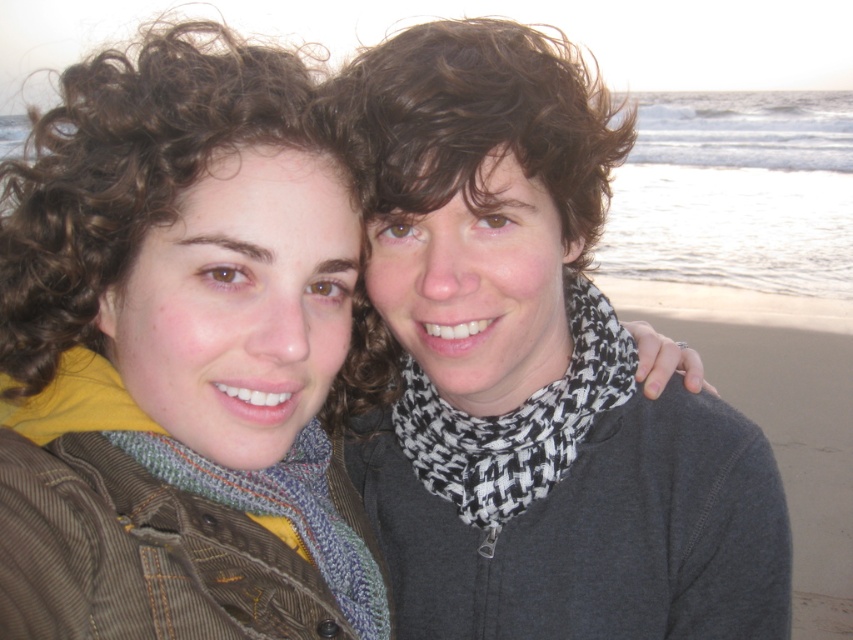
Question: Which object appears closest to the camera in this image?

Choices:
 (A) knitted wool scarf at center
 (B) knitted scarf at center
 (C) black and white woven scarf at center

Answer: (B)

Question: In this image, where is knitted scarf at center located relative to black and white woven scarf at center?

Choices:
 (A) below
 (B) above

Answer: (B)

Question: Can you confirm if black and white woven scarf at center is positioned below knitted wool scarf at center?

Choices:
 (A) yes
 (B) no

Answer: (B)

Question: Is knitted scarf at center smaller than black and white woven scarf at center?

Choices:
 (A) no
 (B) yes

Answer: (A)

Question: Which object appears farthest from the camera in this image?

Choices:
 (A) knitted scarf at center
 (B) black and white woven scarf at center
 (C) knitted wool scarf at center

Answer: (B)

Question: Which object is positioned closest to the knitted scarf at center?

Choices:
 (A) knitted wool scarf at center
 (B) black and white woven scarf at center

Answer: (A)